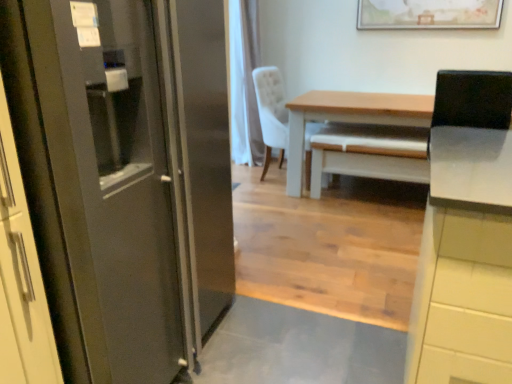
Find the location of a particular element. free point in front of light brown wooden table at center is located at coordinates (350, 246).